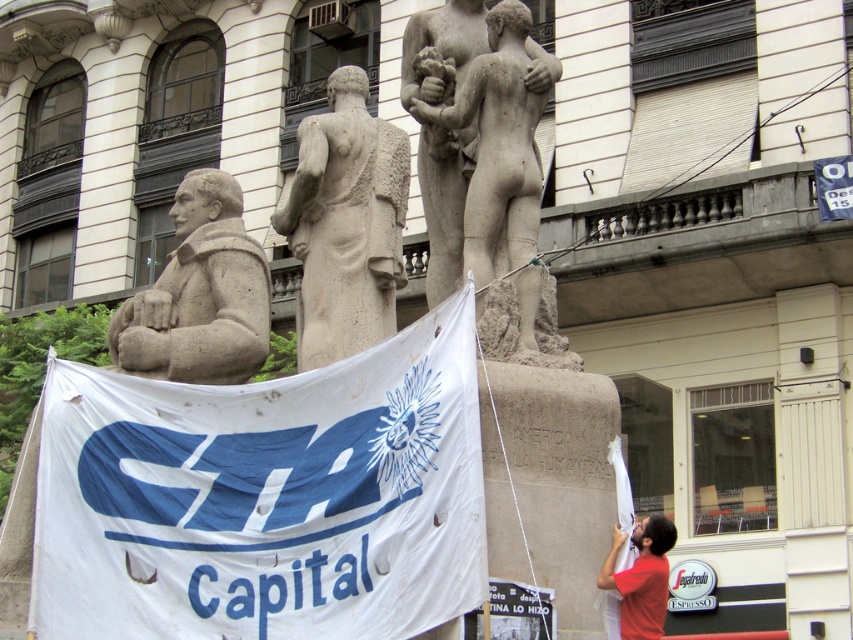
Measure the distance between white fabric banner at center and red cotton shirt at lower right.

5.47 meters

Between point (415, 618) and point (630, 593), which one is positioned behind?

The point (630, 593) is more distant.

At what (x,y) coordinates should I click in order to perform the action: click on white fabric banner at center. Please return your answer as a coordinate pair (x, y). This screenshot has height=640, width=853. Looking at the image, I should click on (265, 497).

Which is behind, point (219, 276) or point (651, 634)?

Point (219, 276)

This screenshot has width=853, height=640. Find the location of `stone statue at left`. stone statue at left is located at coordinates (200, 292).

Is stone nude statue at center closer to camera compared to stone statue at left?

That is True.

Can you confirm if stone nude statue at center is shorter than stone statue at left?

In fact, stone nude statue at center may be taller than stone statue at left.

Which is behind, point (498, 246) or point (260, 266)?

Point (260, 266)

You are a GUI agent. You are given a task and a screenshot of the screen. Output one action in this format:
    pyautogui.click(x=<x>, y=<y>)
    Task: Click on the stone nude statue at center
    This screenshot has width=853, height=640.
    Given the screenshot: What is the action you would take?
    pyautogui.click(x=486, y=168)